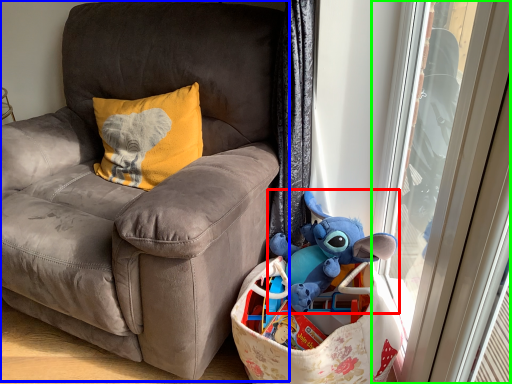
Question: Which object is the closest to the toy (highlighted by a red box)? Choose among these: chair (highlighted by a blue box) or screen door (highlighted by a green box).

Choices:
 (A) chair
 (B) screen door

Answer: (B)